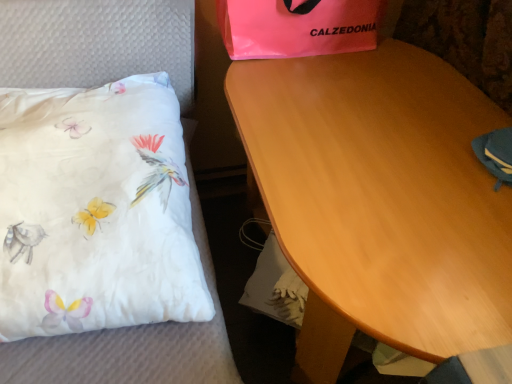
Question: Is white satin pillow at left outside of wooden table at center?

Choices:
 (A) no
 (B) yes

Answer: (B)

Question: From the image's perspective, does white satin pillow at left appear higher than wooden table at center?

Choices:
 (A) yes
 (B) no

Answer: (A)

Question: Considering the relative sizes of white satin pillow at left and wooden table at center in the image provided, is white satin pillow at left thinner than wooden table at center?

Choices:
 (A) yes
 (B) no

Answer: (A)

Question: Considering the relative sizes of white satin pillow at left and wooden table at center in the image provided, is white satin pillow at left wider than wooden table at center?

Choices:
 (A) yes
 (B) no

Answer: (B)

Question: Does white satin pillow at left appear on the left side of wooden table at center?

Choices:
 (A) yes
 (B) no

Answer: (A)

Question: From a real-world perspective, relative to pink plastic bag at upper center, is white satin pillow at left vertically above or below?

Choices:
 (A) above
 (B) below

Answer: (B)

Question: Considering the positions of point (103, 36) and point (327, 1), is point (103, 36) closer or farther from the camera than point (327, 1)?

Choices:
 (A) farther
 (B) closer

Answer: (B)

Question: Considering the relative positions of white satin pillow at left and pink plastic bag at upper center in the image provided, is white satin pillow at left to the left or to the right of pink plastic bag at upper center?

Choices:
 (A) right
 (B) left

Answer: (B)

Question: In the image, is white satin pillow at left positioned in front of or behind pink plastic bag at upper center?

Choices:
 (A) front
 (B) behind

Answer: (A)

Question: Considering the positions of wooden table at center and pink plastic bag at upper center in the image, is wooden table at center bigger or smaller than pink plastic bag at upper center?

Choices:
 (A) big
 (B) small

Answer: (A)

Question: From a real-world perspective, is wooden table at center above or below pink plastic bag at upper center?

Choices:
 (A) above
 (B) below

Answer: (B)

Question: Would you say wooden table at center is to the left or to the right of pink plastic bag at upper center in the picture?

Choices:
 (A) right
 (B) left

Answer: (A)

Question: Choose the correct answer: Is wooden table at center inside pink plastic bag at upper center or outside it?

Choices:
 (A) inside
 (B) outside

Answer: (B)

Question: Is white satin pillow at left inside or outside of wooden table at center?

Choices:
 (A) inside
 (B) outside

Answer: (B)

Question: In the image, is white satin pillow at left positioned in front of or behind wooden table at center?

Choices:
 (A) front
 (B) behind

Answer: (B)